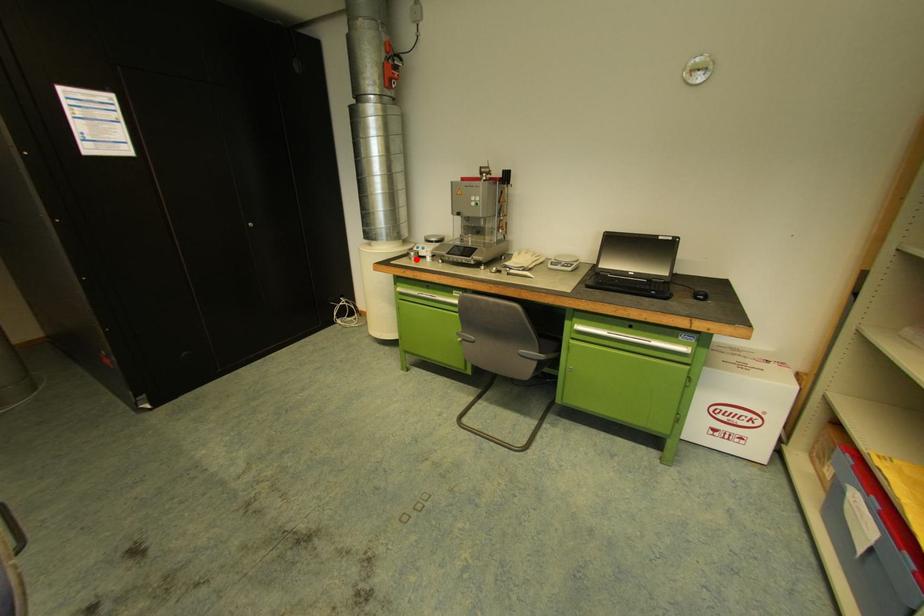
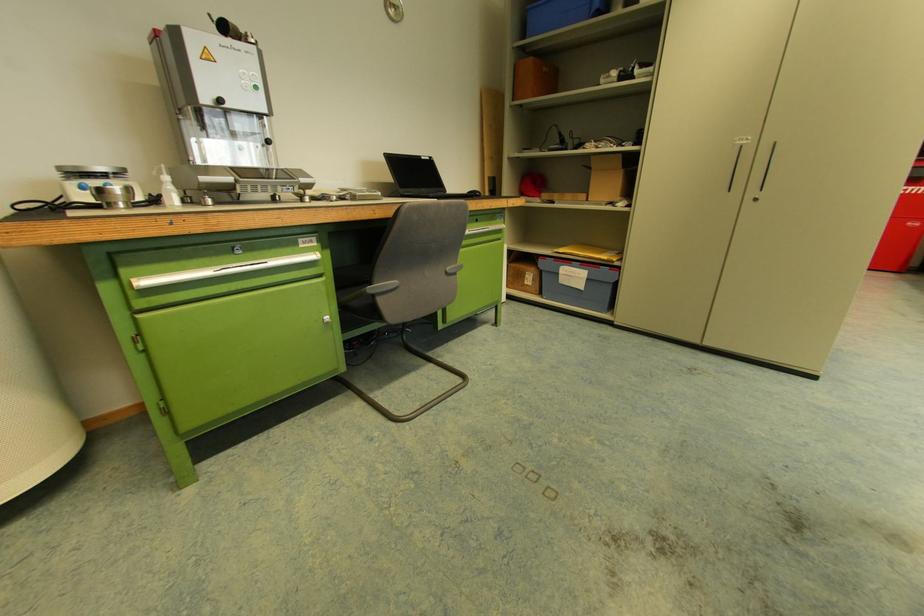
Find the pixel in the second image that matches the highlighted location in the first image.

(127, 207)